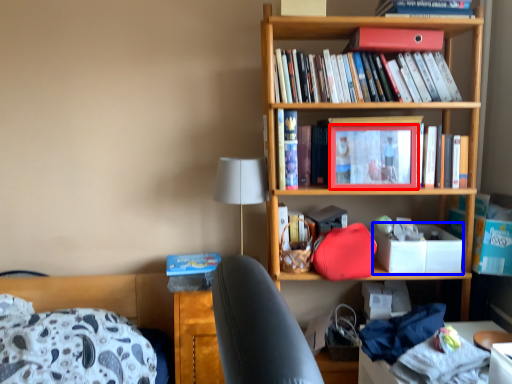
Question: Which point is further to the camera, picture frame (highlighted by a red box) or box (highlighted by a blue box)?

Choices:
 (A) picture frame
 (B) box

Answer: (B)